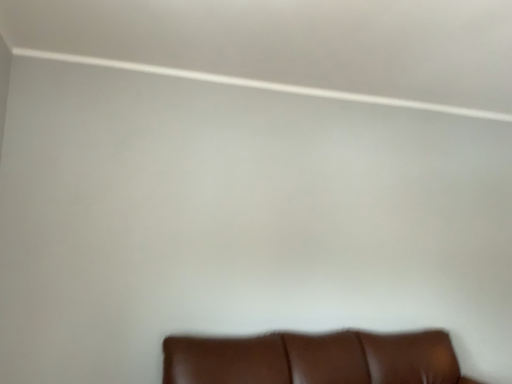
Question: Should I look upward or downward to see brown leather couch at lower center?

Choices:
 (A) up
 (B) down

Answer: (B)